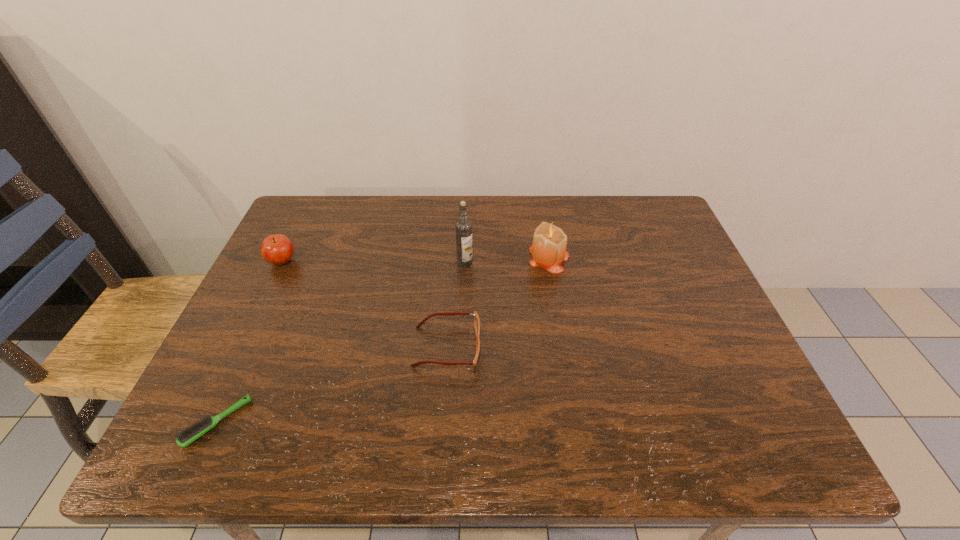
Locate an element on the screen. The height and width of the screenshot is (540, 960). free region located on the front of the apple is located at coordinates (270, 287).

Find the location of a particular element. This screenshot has height=540, width=960. blank space located 0.280m on the front-facing side of the spectacles is located at coordinates (602, 347).

At what (x,y) coordinates should I click in order to perform the action: click on free space located 0.370m on the back of the nearest object. Please return your answer as a coordinate pair (x, y). The height and width of the screenshot is (540, 960). Looking at the image, I should click on (285, 275).

The width and height of the screenshot is (960, 540). In order to click on object located at the far edge in this screenshot , I will do `click(548, 250)`.

Identify the location of object at the near edge. The width and height of the screenshot is (960, 540). (192, 433).

The height and width of the screenshot is (540, 960). In order to click on apple that is at the left edge in this screenshot , I will do `click(277, 249)`.

This screenshot has height=540, width=960. I want to click on hairbrush present at the left edge, so click(x=192, y=433).

At what (x,y) coordinates should I click in order to perform the action: click on object positioned at the near left corner. Please return your answer as a coordinate pair (x, y). Looking at the image, I should click on (192, 433).

Locate an element on the screen. Image resolution: width=960 pixels, height=540 pixels. blank area at the far edge is located at coordinates (443, 226).

Where is `blank area at the left edge`? This screenshot has width=960, height=540. blank area at the left edge is located at coordinates (282, 376).